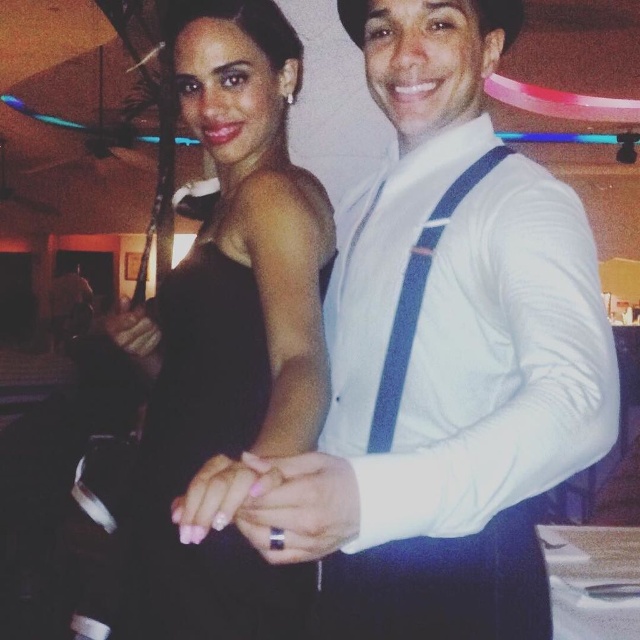
You are a photographer at a social event and need to adjust the lighting to ensure both the white satin shirt at center and the black satin dress at center are equally visible. Considering their sizes, which garment should you focus more light on?

The white satin shirt at center has a smaller size compared to the black satin dress at center, so you should focus more light on the white satin shirt at center to ensure it is as visible as the larger black satin dress at center.

You are a photographer at a social event. You need to adjust the lighting to ensure both the white satin shirt at center and the black satin dress at center are visible. Which object should you focus on first to balance the exposure?

The white satin shirt at center is positioned over black satin dress at center, so you should focus on balancing the exposure for the white satin shirt at center first to avoid overexposure, then adjust for the black satin dress at center to prevent underexposure.